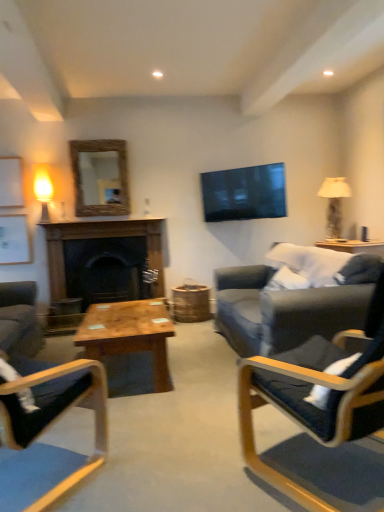
Locate an element on the screen. This screenshot has width=384, height=512. free point below wooden armchair at center, the first chair viewed from the left (from a real-world perspective) is located at coordinates coord(38,469).